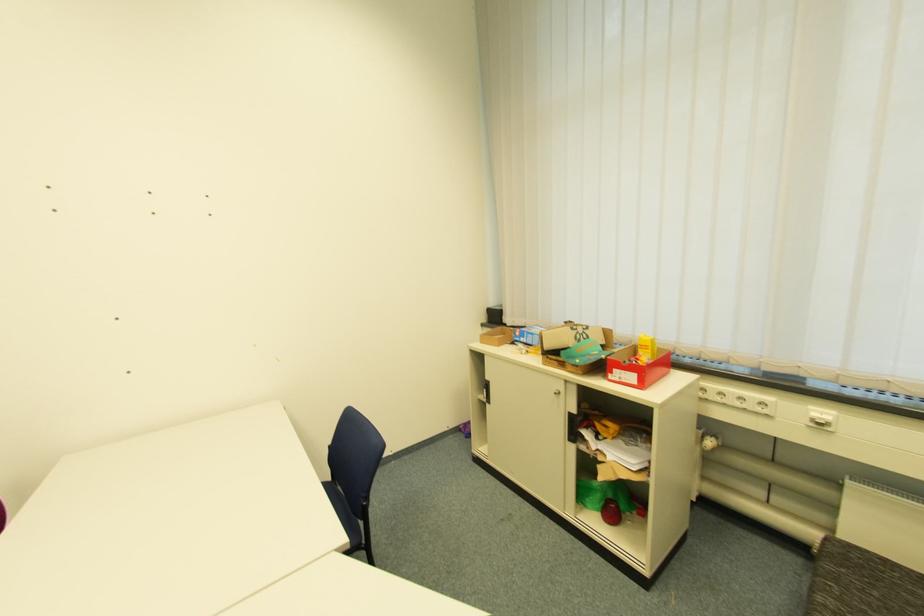
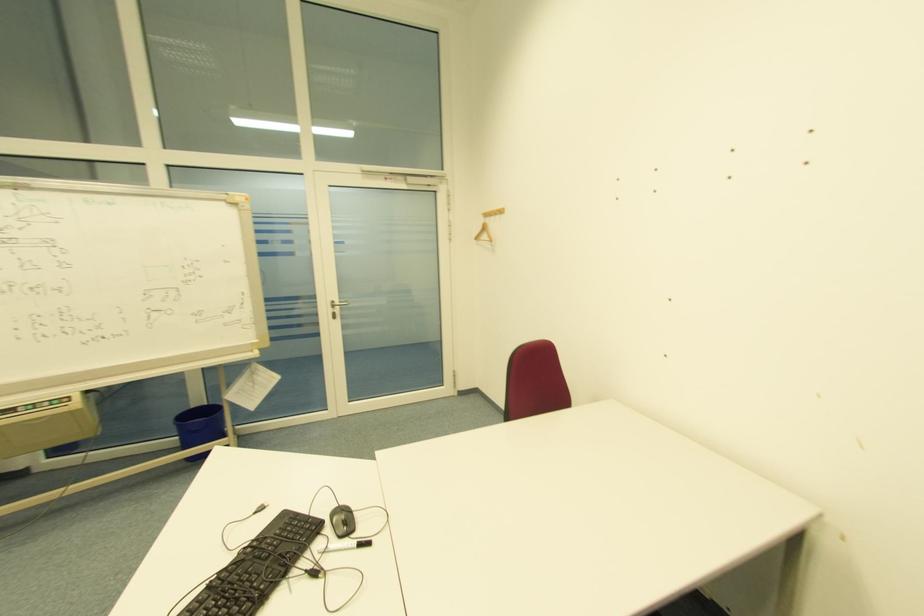
How did the camera likely rotate?

The rotation direction of the camera is left-down.